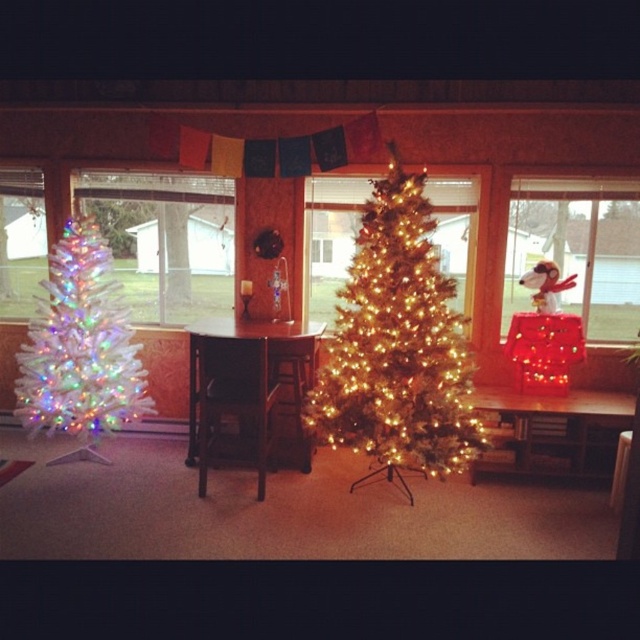
Can you confirm if white frosted glass window at left is taller than illuminated gold tree at center?

Yes, white frosted glass window at left is taller than illuminated gold tree at center.

Is point (140, 282) positioned in front of point (333, 280)?

No, it is not.

Which is behind, point (209, 195) or point (460, 273)?

The point (209, 195) is more distant.

In order to click on white frosted glass window at left in this screenshot , I will do `click(164, 241)`.

Is white frosted christmas tree at left taller than red fabric snoopy at right?

Yes.

How far apart are white frosted christmas tree at left and red fabric snoopy at right?

white frosted christmas tree at left is 2.75 meters from red fabric snoopy at right.

The height and width of the screenshot is (640, 640). What are the coordinates of `white frosted christmas tree at left` in the screenshot? It's located at (81, 348).

Between point (586, 193) and point (10, 195), which one is positioned behind?

Positioned behind is point (10, 195).

Can you confirm if red fabric snoopy at right is shorter than clear glass window at left?

In fact, red fabric snoopy at right may be taller than clear glass window at left.

Describe the element at coordinates (577, 250) in the screenshot. The width and height of the screenshot is (640, 640). I see `red fabric snoopy at right` at that location.

At what (x,y) coordinates should I click in order to perform the action: click on red fabric snoopy at right. Please return your answer as a coordinate pair (x, y). This screenshot has width=640, height=640. Looking at the image, I should click on pos(577,250).